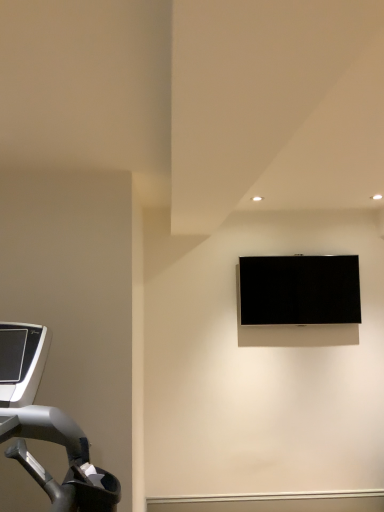
At what (x,y) coordinates should I click in order to perform the action: click on matte black tv at upper right. Please return your answer as a coordinate pair (x, y). The width and height of the screenshot is (384, 512). Looking at the image, I should click on (300, 290).

What do you see at coordinates (300, 290) in the screenshot? I see `matte black tv at upper right` at bounding box center [300, 290].

Image resolution: width=384 pixels, height=512 pixels. I want to click on matte black tv at upper right, so click(x=300, y=290).